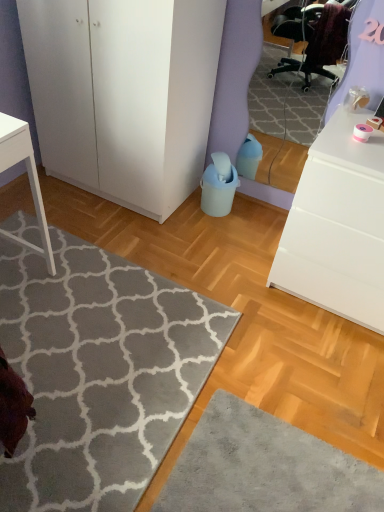
Where is `free point below gray soft rug at lower left (from a real-world perspective)`? The height and width of the screenshot is (512, 384). free point below gray soft rug at lower left (from a real-world perspective) is located at coordinates (91, 360).